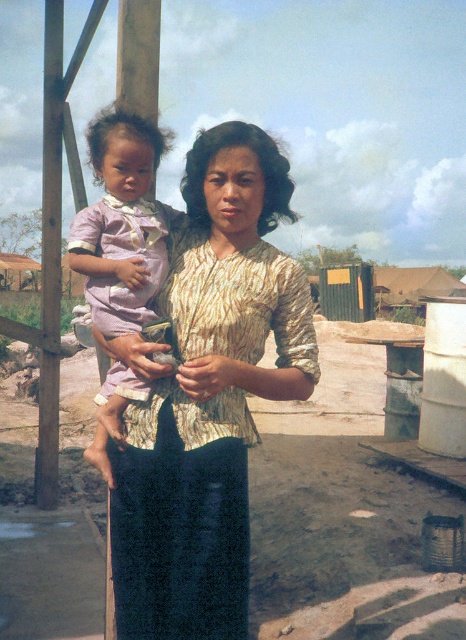
You are a photographer trying to capture a closeup of the printed fabric blouse at center and the pink satin dress at left. Which one is on the right side of the other?

The printed fabric blouse at center is positioned on the right side of pink satin dress at left.

You are a tailor who needs to determine which garment is taller between the printed fabric blouse at center and the pink satin dress at left. Based on the image, which one is taller?

The printed fabric blouse at center is taller than the pink satin dress at left according to the description.

You are a photographer trying to capture the woman and child in the scene. If you want to focus on the printed fabric blouse at center, where should you aim your camera? Please provide the coordinates mentioned in the description.

The printed fabric blouse at center is located at point [207,396], so you should aim your camera at those coordinates to focus on it.